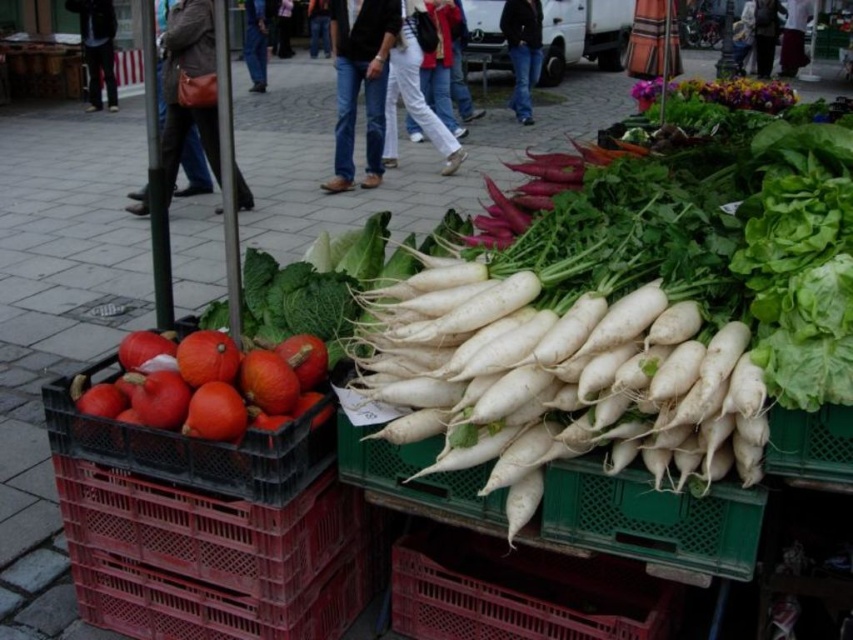
You are a customer at the market and want to pick up both the matte plastic basket at lower center and the orange matte pumpkin at left. Which item will you need to reach for first as you approach the display?

You will need to reach for the matte plastic basket at lower center first because it is closer to you than the orange matte pumpkin at left, which is further back in the display.